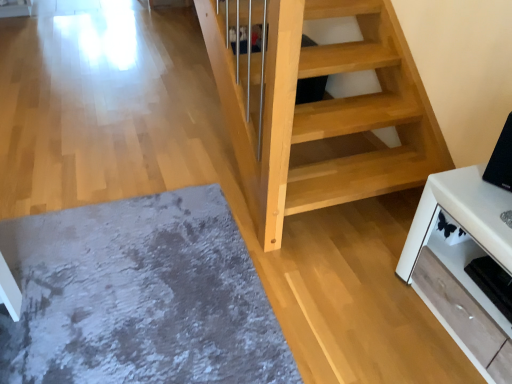
Question: Does gray shaggy rug at lower left have a lesser height compared to white glossy tv stand at lower right?

Choices:
 (A) no
 (B) yes

Answer: (B)

Question: Is gray shaggy rug at lower left taller than white glossy tv stand at lower right?

Choices:
 (A) yes
 (B) no

Answer: (B)

Question: Is gray shaggy rug at lower left outside of white glossy tv stand at lower right?

Choices:
 (A) no
 (B) yes

Answer: (B)

Question: Is gray shaggy rug at lower left further to the viewer compared to white glossy tv stand at lower right?

Choices:
 (A) yes
 (B) no

Answer: (A)

Question: From a real-world perspective, is gray shaggy rug at lower left physically above white glossy tv stand at lower right?

Choices:
 (A) yes
 (B) no

Answer: (B)

Question: Relative to black glossy tv at upper right, is white glossy tv stand at lower right in front or behind?

Choices:
 (A) front
 (B) behind

Answer: (A)

Question: Is white glossy tv stand at lower right inside the boundaries of black glossy tv at upper right, or outside?

Choices:
 (A) inside
 (B) outside

Answer: (B)

Question: Looking at their shapes, would you say white glossy tv stand at lower right is wider or thinner than black glossy tv at upper right?

Choices:
 (A) thin
 (B) wide

Answer: (B)

Question: Considering the relative positions of white glossy tv stand at lower right and black glossy tv at upper right in the image provided, is white glossy tv stand at lower right to the left or to the right of black glossy tv at upper right?

Choices:
 (A) left
 (B) right

Answer: (A)

Question: Looking at the image, does white glossy tv stand at lower right seem bigger or smaller compared to gray shaggy rug at lower left?

Choices:
 (A) small
 (B) big

Answer: (B)

Question: Considering their positions, is white glossy tv stand at lower right located in front of or behind gray shaggy rug at lower left?

Choices:
 (A) front
 (B) behind

Answer: (A)

Question: Considering the relative positions of white glossy tv stand at lower right and gray shaggy rug at lower left in the image provided, is white glossy tv stand at lower right to the left or to the right of gray shaggy rug at lower left?

Choices:
 (A) left
 (B) right

Answer: (B)

Question: Does point (486, 377) appear closer or farther from the camera than point (221, 354)?

Choices:
 (A) closer
 (B) farther

Answer: (A)

Question: Considering their positions, is gray shaggy rug at lower left located in front of or behind white glossy tv stand at lower right?

Choices:
 (A) behind
 (B) front

Answer: (A)

Question: Does point (100, 243) appear closer or farther from the camera than point (448, 215)?

Choices:
 (A) farther
 (B) closer

Answer: (A)